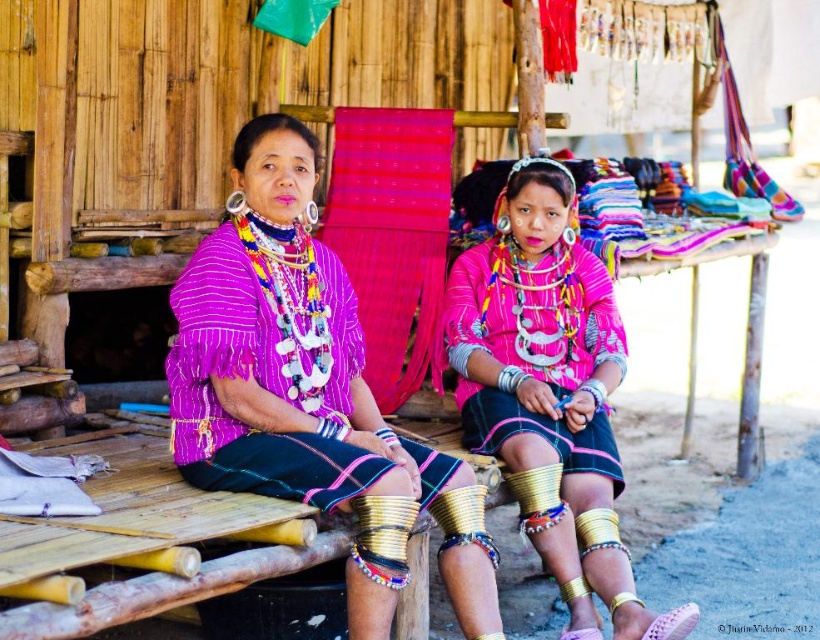
This screenshot has width=820, height=640. I want to click on matte purple blouse at center, so click(308, 392).

Who is lower down, matte purple blouse at center or pink matte fabric at center?

pink matte fabric at center

Who is more forward, [442,572] or [518,259]?

Point [442,572] is in front.

The width and height of the screenshot is (820, 640). Find the location of `matte purple blouse at center`. matte purple blouse at center is located at coordinates (308, 392).